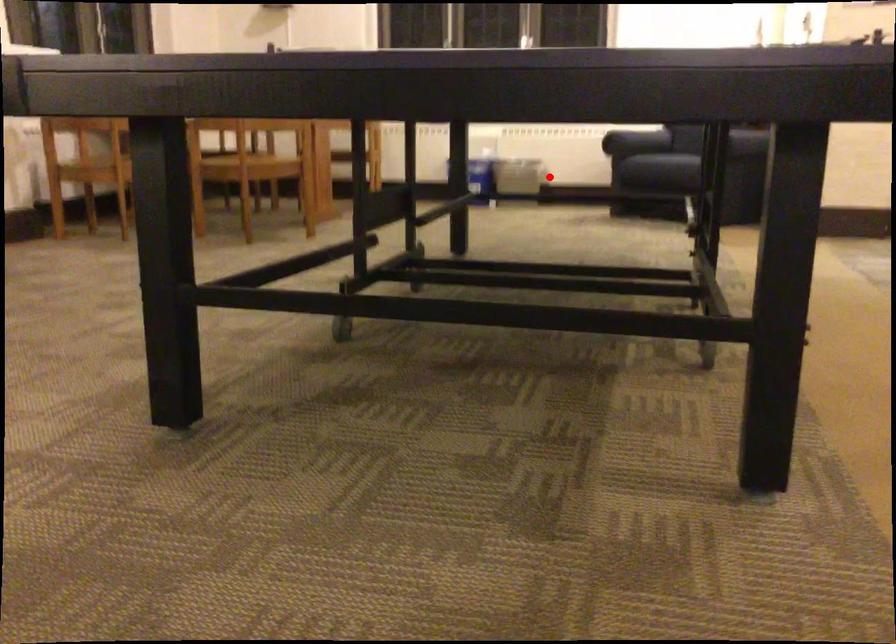
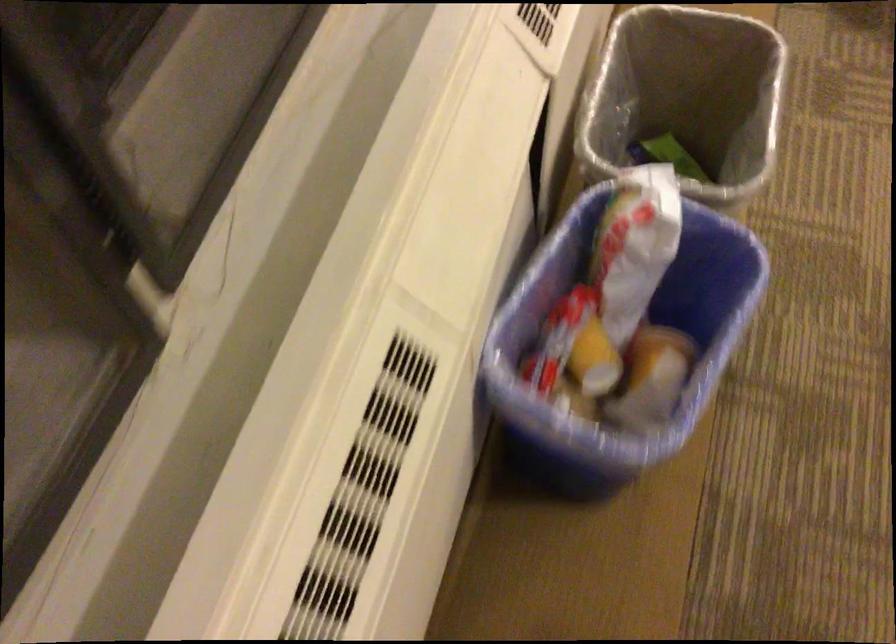
Question: A red point is marked in image1. In image2, is the corresponding 3D point closer to the camera or farther? Reply with the corresponding letter.

Choices:
 (A) The corresponding 3D point is closer.
 (B) The corresponding 3D point is farther.

Answer: (A)